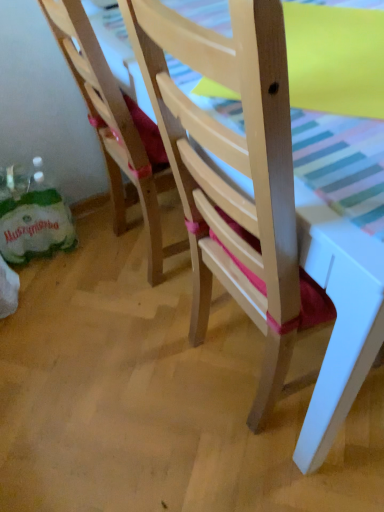
Identify the location of vacant region to the left of wooden chair at center, which is the first chair from right to left. This screenshot has height=512, width=384. (140, 386).